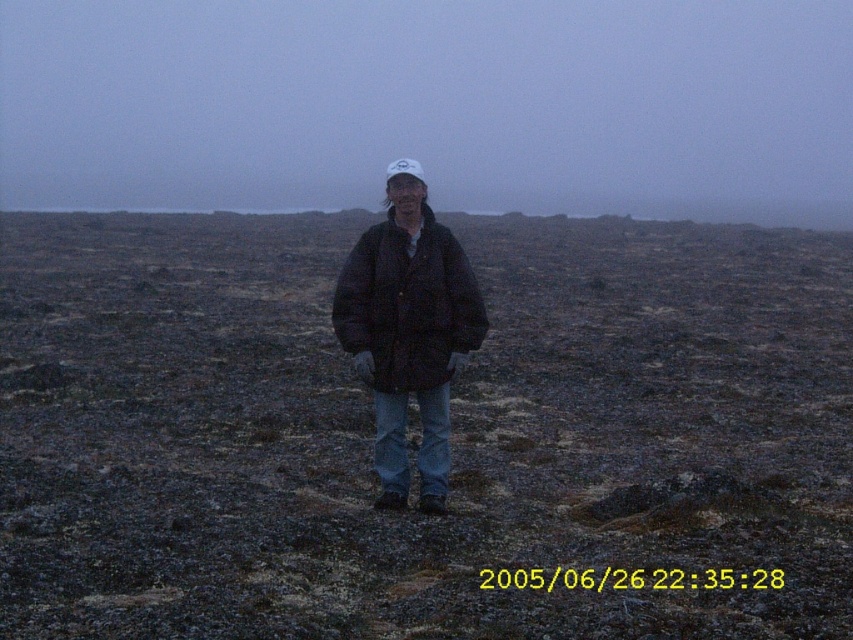
Question: Is dark brown soil at center to the left of black puffy jacket at center from the viewer's perspective?

Choices:
 (A) yes
 (B) no

Answer: (B)

Question: Observing the image, what is the correct spatial positioning of dark brown soil at center in reference to black puffy jacket at center?

Choices:
 (A) below
 (B) above

Answer: (A)

Question: Which of the following is the farthest from the observer?

Choices:
 (A) (424, 356)
 (B) (288, 342)

Answer: (B)

Question: Can you confirm if dark brown soil at center is bigger than black puffy jacket at center?

Choices:
 (A) no
 (B) yes

Answer: (B)

Question: Which point is closer to the camera taking this photo?

Choices:
 (A) (450, 372)
 (B) (80, 396)

Answer: (A)